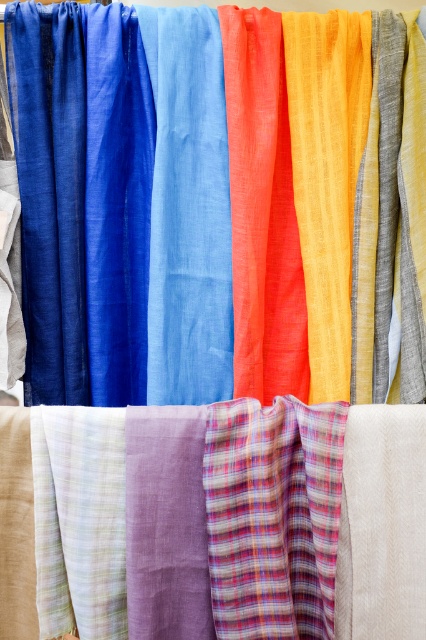
Which of these two, plaid fabric at center or matte blue fabric at center, stands taller?

matte blue fabric at center is taller.

Can you confirm if plaid fabric at center is taller than matte blue fabric at center?

Incorrect, plaid fabric at center's height is not larger of matte blue fabric at center's.

Which is in front, point (397, 509) or point (238, 198)?

Point (397, 509) is in front.

The width and height of the screenshot is (426, 640). In order to click on plaid fabric at center in this screenshot , I will do `click(104, 522)`.